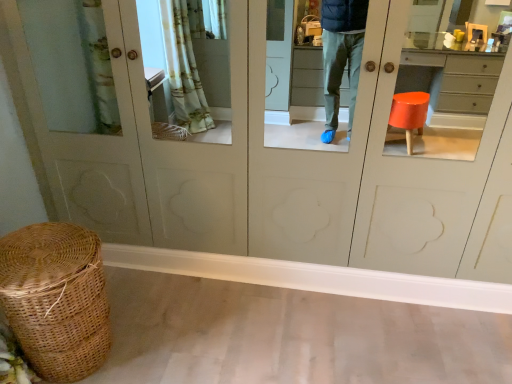
This screenshot has width=512, height=384. Identify the location of empty space that is to the right of woven brown basket at lower left. (169, 339).